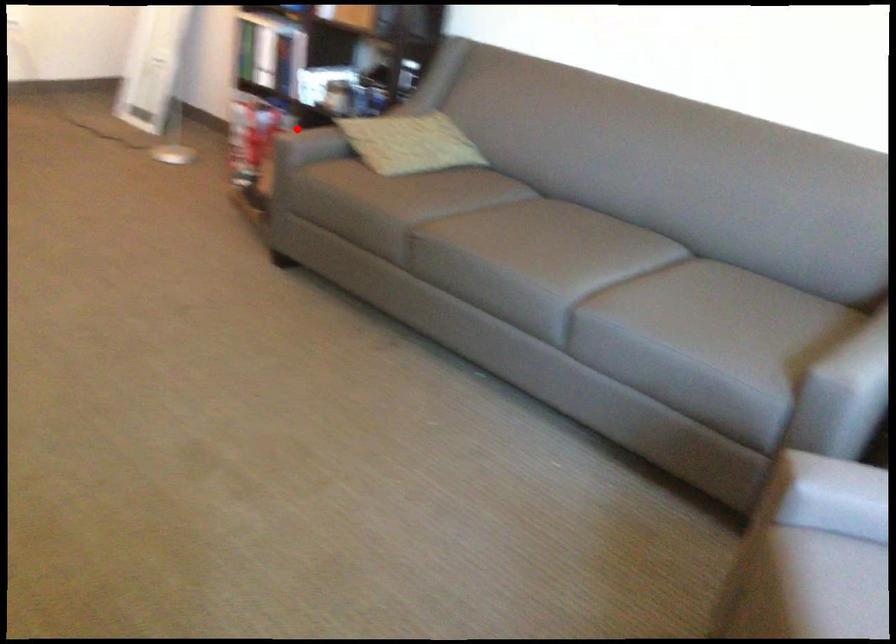
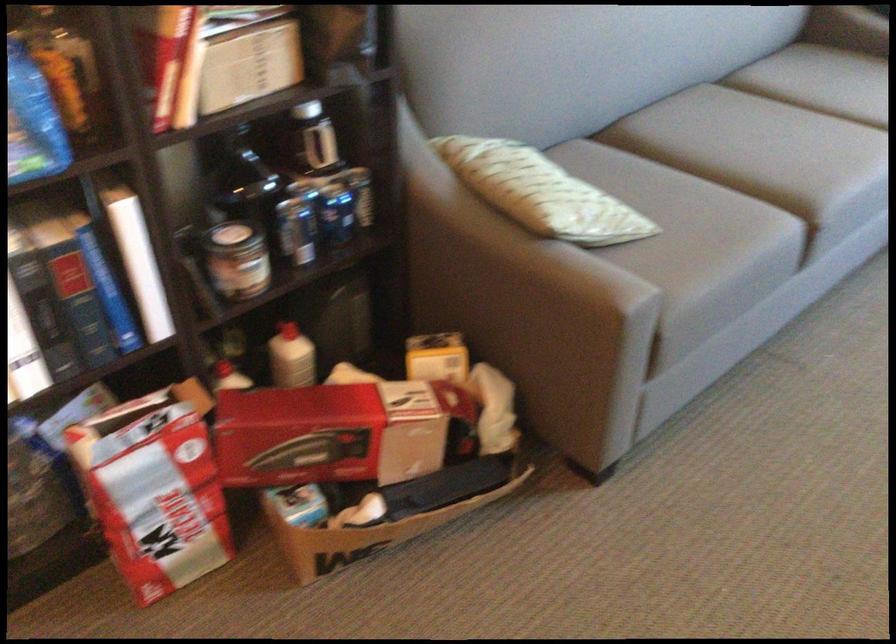
Question: A red point is marked in image1. In image2, is the corresponding 3D point closer to the camera or farther? Reply with the corresponding letter.

Choices:
 (A) The corresponding 3D point is closer.
 (B) The corresponding 3D point is farther.

Answer: (A)